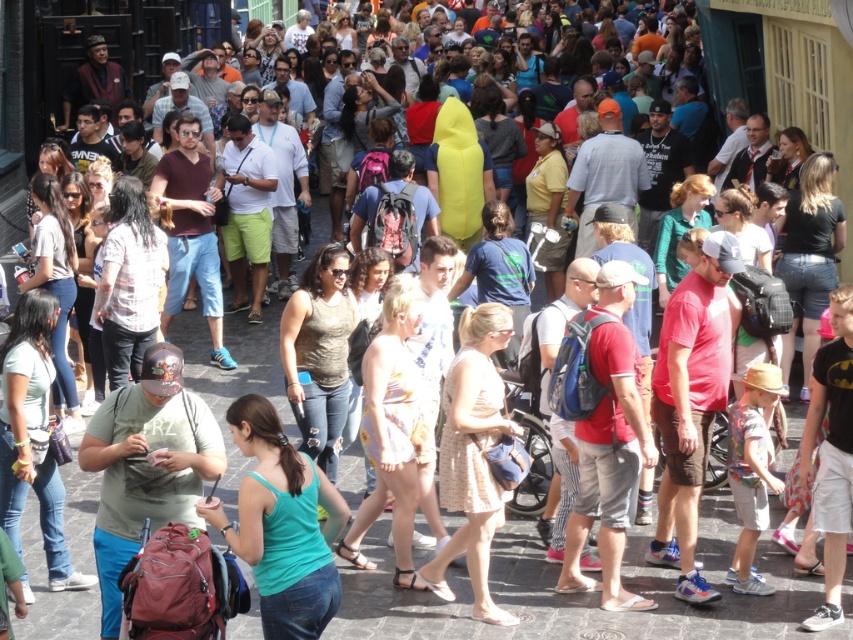
You are a fashion designer observing the crowd and notice two people wearing a teal fabric tank top at center and a plaid shirt at center. Which clothing item has a greater width?

The teal fabric tank top at center has a greater width than the plaid shirt at center.

You are a photographer standing in the middle of the street. You see the black denim shorts at right and the denim jeans at left. Can you fit both of them in your camera frame if your camera has a 10 meter field of view?

The black denim shorts at right and denim jeans at left are 8.98 meters apart. Since your camera has a 10 meter field of view, which is wider than the distance between them, you can fit both of them in your camera frame.